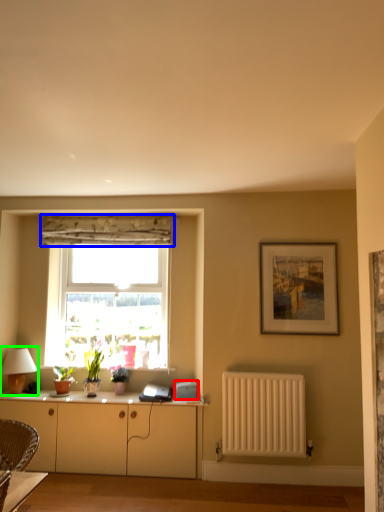
Question: Considering the real-world distances, which object is closest to appliance (highlighted by a red box)? curtain (highlighted by a blue box) or table lamp (highlighted by a green box).

Choices:
 (A) curtain
 (B) table lamp

Answer: (B)